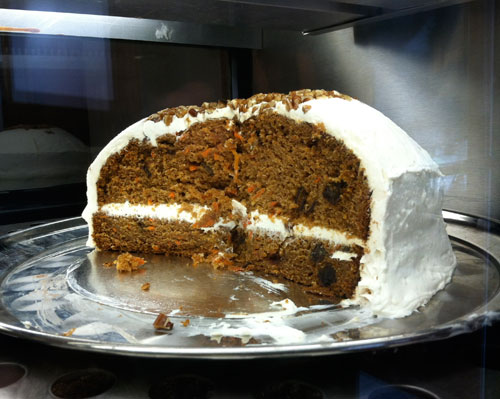
The image size is (500, 399). In order to click on silver tray in this screenshot , I will do `click(194, 291)`.